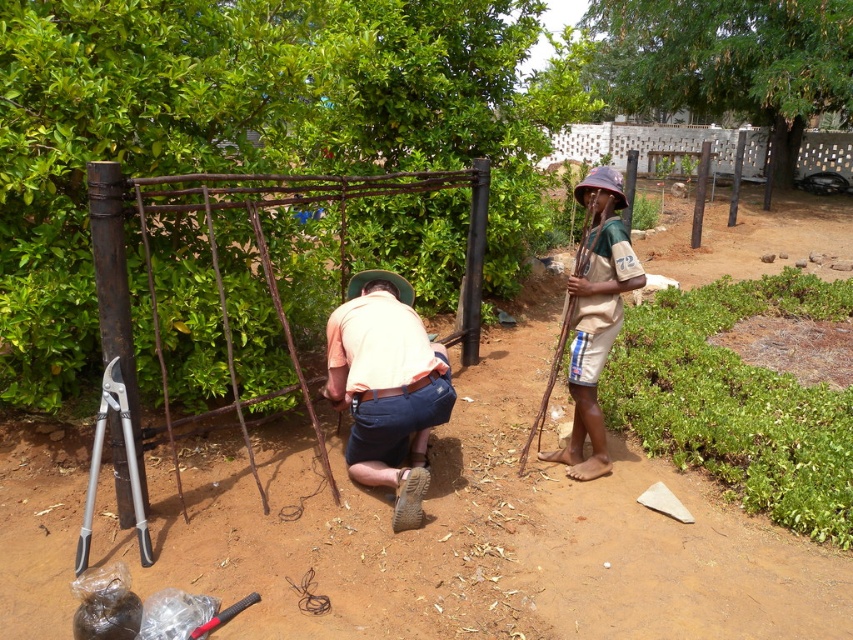
You are a landscape designer planning to install a new pathway in the garden. The pathway must be wide enough to accommodate a standard garden cart. Given the brown dirt field at center and the white brick fence at upper center, which area has a narrower width that might require adjustment for the cart to pass through comfortably?

The brown dirt field at center has a narrower width compared to the white brick fence at upper center, so adjustments may be needed there to ensure the garden cart can pass through comfortably.

You are a worker in the garden and you need to place a tool on the ground. If you want to put the tool on the brown dirt field at center, which is below the brown fabric hat at right, where should you look relative to the hat?

Since the brown dirt field at center is located below the brown fabric hat at right, you should look downward from the hat to place the tool on the dirt field.